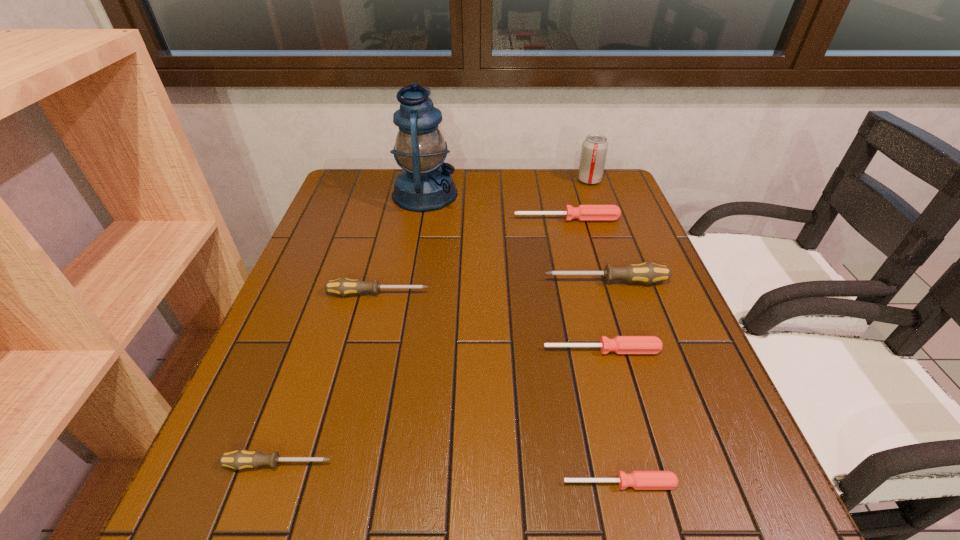
Image resolution: width=960 pixels, height=540 pixels. What are the coordinates of `the third nearest object` in the screenshot? It's located at (620, 344).

Identify the location of the seventh farthest object. (239, 459).

Find the location of a particular element. The width and height of the screenshot is (960, 540). the smallest gray screwdriver is located at coordinates (239, 459).

Locate an element on the screen. the shortest object is located at coordinates (640, 480).

This screenshot has height=540, width=960. Identify the location of the smallest red screwdriver. (640, 480).

Find the location of a particular element. This screenshot has width=960, height=540. vacant space positioned 0.090m on the face of the tallest object is located at coordinates (487, 194).

Identify the location of vacant area located on the front of the second tallest object. (606, 227).

Identify the location of vacant space located at the tip of the third tallest object. (466, 281).

Where is `free space located at the tip of the third tallest object`? Image resolution: width=960 pixels, height=540 pixels. free space located at the tip of the third tallest object is located at coordinates (433, 281).

I want to click on vacant space located at the tip of the third tallest object, so click(487, 281).